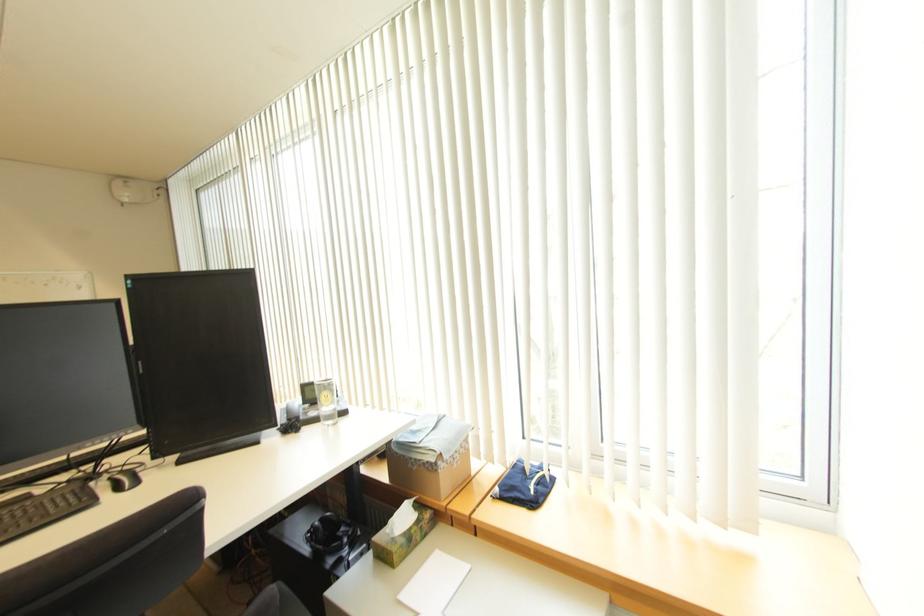
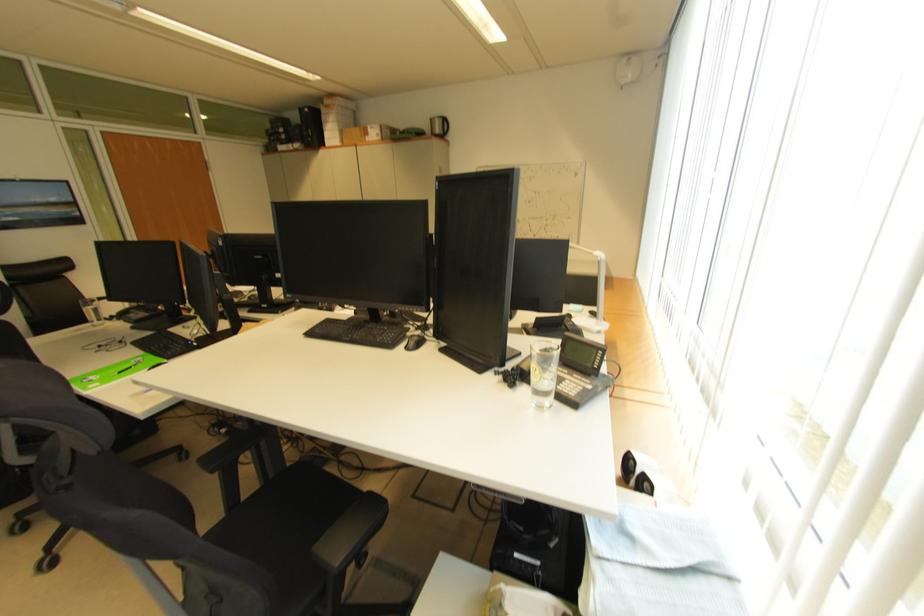
Find the pixel in the second image that matches the point at 333,402 in the first image.

(541, 379)